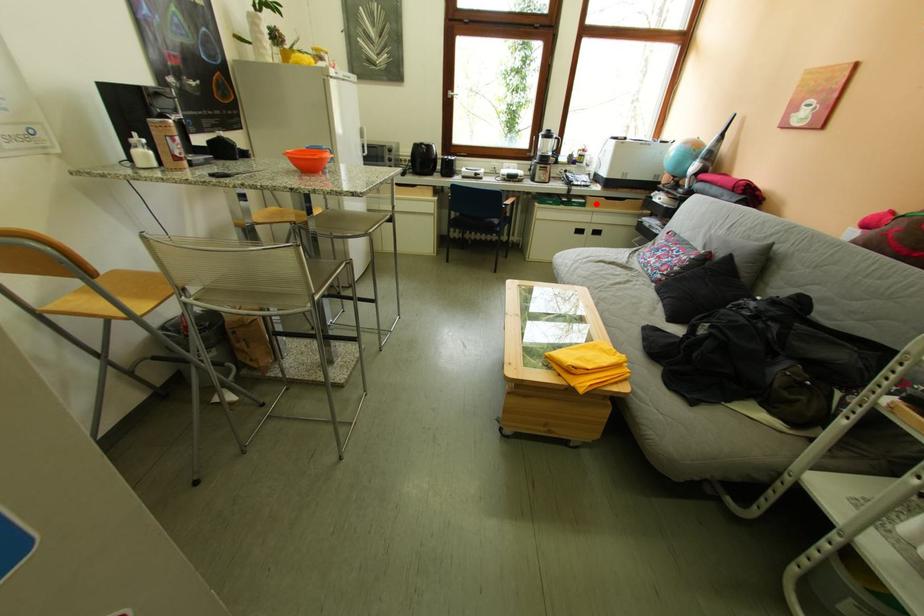
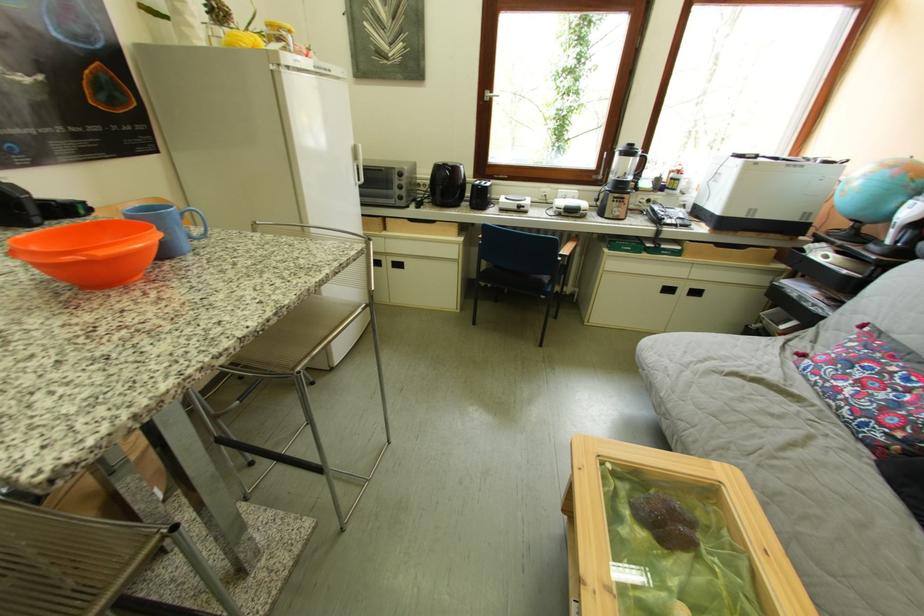
The point at the highlighted location is marked in the first image. Where is the corresponding point in the second image?

(690, 251)